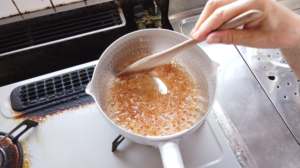
At what (x,y) coordinates should I click in order to perform the action: click on wooden spoon. Please return your answer as a coordinate pair (x, y). The image size is (300, 168). Looking at the image, I should click on (167, 54).